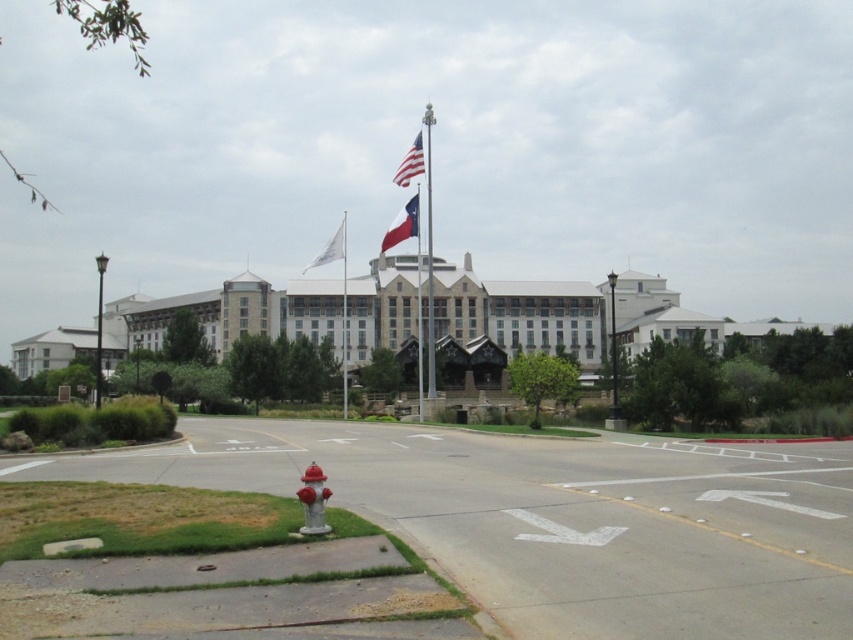
In the scene shown: Can you confirm if metallic flag pole at center is positioned above white fabric flag at center?

Yes.

Measure the distance between metallic flag pole at center and camera.

metallic flag pole at center is 53.04 meters away from camera.

Find the location of a particular element. The image size is (853, 640). metallic flag pole at center is located at coordinates (428, 257).

Does metallic flag pole at center have a greater height compared to white fabric flagpole at center?

Yes.

Consider the image. Does metallic flag pole at center appear on the left side of white fabric flagpole at center?

No, metallic flag pole at center is not to the left of white fabric flagpole at center.

Where is `metallic flag pole at center`? metallic flag pole at center is located at coordinates click(428, 257).

The height and width of the screenshot is (640, 853). In order to click on metallic flag pole at center in this screenshot , I will do `click(428, 257)`.

Based on the photo, does silver metallic fire hydrant at lower center appear on the left side of red fabric flag at center?

In fact, silver metallic fire hydrant at lower center is to the right of red fabric flag at center.

Measure the distance from silver metallic fire hydrant at lower center to red fabric flag at center.

The distance of silver metallic fire hydrant at lower center from red fabric flag at center is 136.85 meters.

Is point (308, 467) positioned before point (390, 241)?

Yes, it is in front of point (390, 241).

Find the location of `silver metallic fire hydrant at lower center`. silver metallic fire hydrant at lower center is located at coordinates (312, 500).